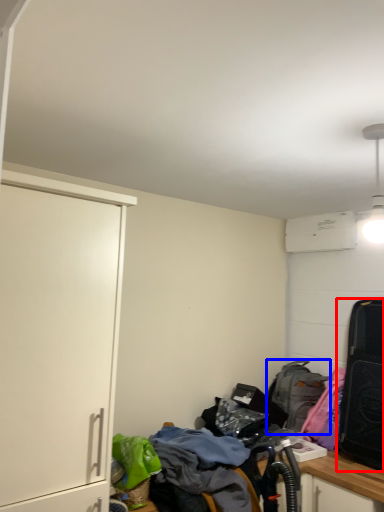
Question: Which point is further to the camera, luggage and bags (highlighted by a red box) or backpack (highlighted by a blue box)?

Choices:
 (A) luggage and bags
 (B) backpack

Answer: (B)